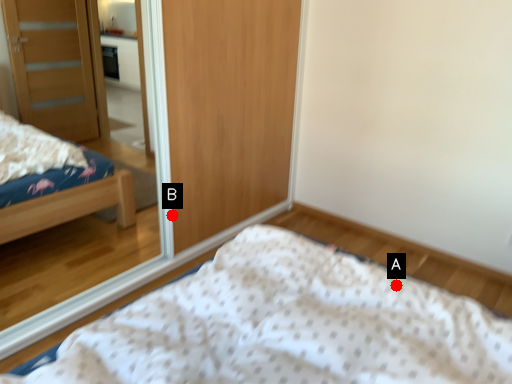
Question: Two points are circled on the image, labeled by A and B beside each circle. Which point appears closest to the camera in this image?

Choices:
 (A) A is closer
 (B) B is closer

Answer: (A)